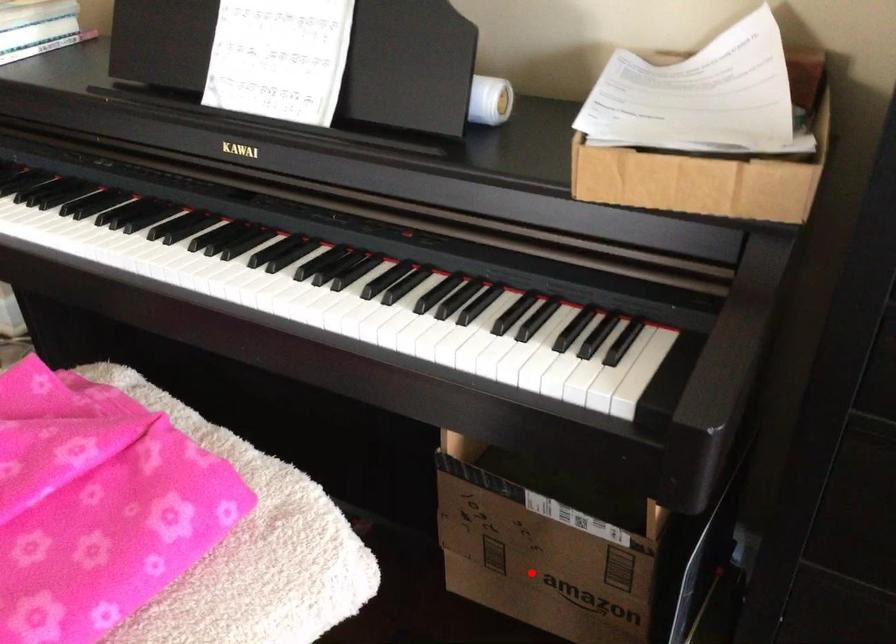
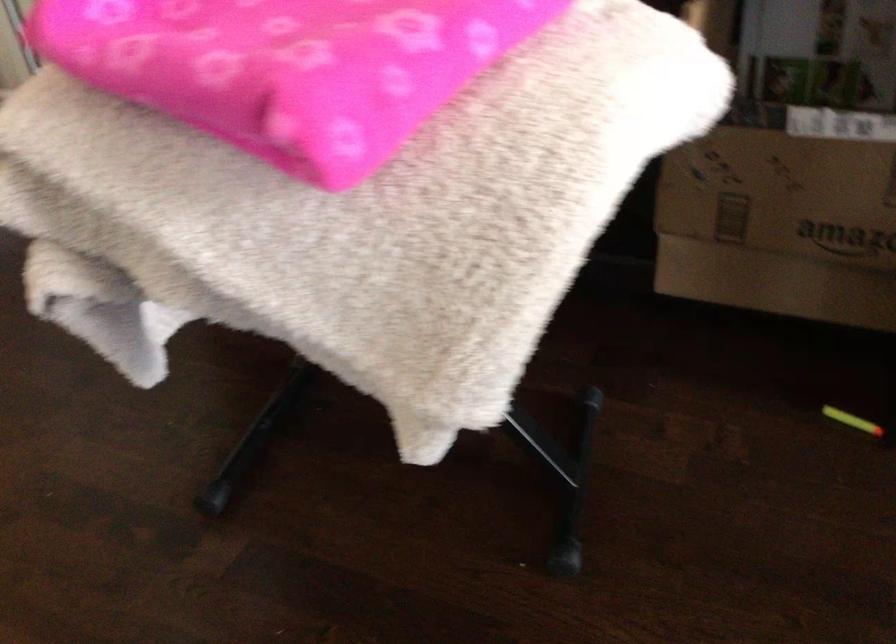
In the second image, find the point that corresponds to the highlighted location in the first image.

(780, 225)